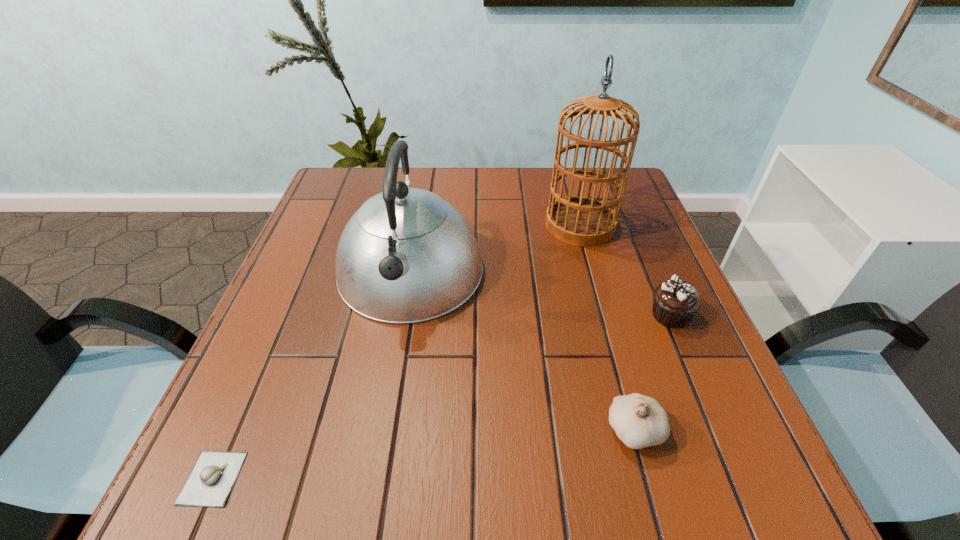
I want to click on object that is positioned at the near right corner, so click(x=639, y=421).

The height and width of the screenshot is (540, 960). Identify the location of vacant space at the far edge of the desktop. (566, 191).

In the image, there is a desktop. In order to click on vacant area at the near edge in this screenshot , I will do `click(660, 502)`.

The width and height of the screenshot is (960, 540). Identify the location of free location at the left edge of the desktop. (284, 301).

In the image, there is a desktop. At what (x,y) coordinates should I click in order to perform the action: click on blank space at the right edge. Please return your answer as a coordinate pair (x, y). This screenshot has height=540, width=960. Looking at the image, I should click on (674, 437).

Where is `free region at the far left corner of the desktop`? This screenshot has width=960, height=540. free region at the far left corner of the desktop is located at coordinates (335, 203).

The image size is (960, 540). Find the location of `free space at the far right corner`. free space at the far right corner is located at coordinates (616, 172).

The image size is (960, 540). In order to click on free spot at the near right corner of the desktop in this screenshot , I will do `click(724, 496)`.

Where is `empty space between the kettle and the birdcage`? This screenshot has width=960, height=540. empty space between the kettle and the birdcage is located at coordinates (495, 249).

Locate an element on the screen. The width and height of the screenshot is (960, 540). free space between the taller garlic and the shorter garlic is located at coordinates (423, 454).